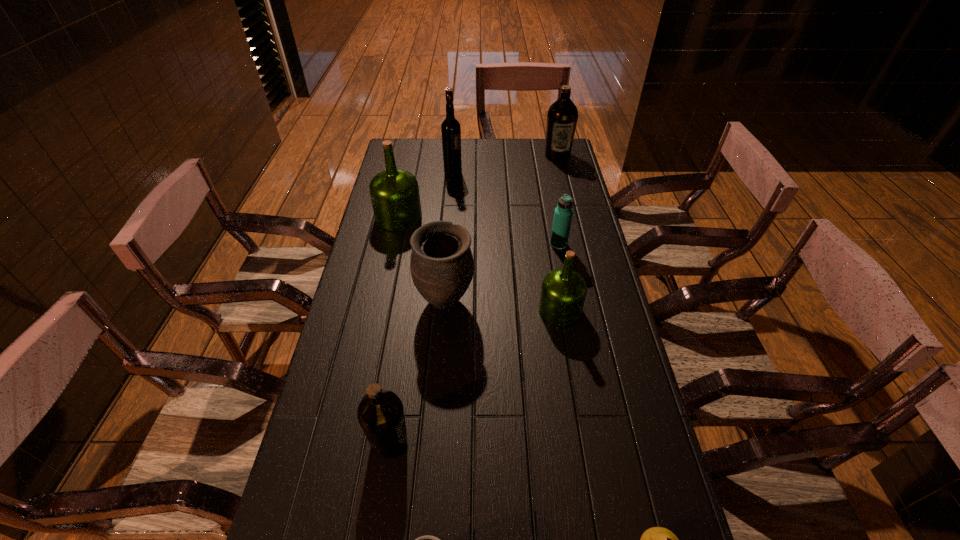
Identify the location of thermos bottle that is at the right edge. This screenshot has height=540, width=960. (563, 213).

Where is `object that is at the far right corner`? This screenshot has height=540, width=960. object that is at the far right corner is located at coordinates (562, 116).

At what (x,y) coordinates should I click in order to perform the action: click on vacant space at the far edge. Please return your answer as a coordinate pair (x, y). Looking at the image, I should click on (494, 154).

Where is `free point at the left edge`? The image size is (960, 540). free point at the left edge is located at coordinates click(340, 381).

Locate an element on the screen. The height and width of the screenshot is (540, 960). free space at the right edge of the desktop is located at coordinates (601, 504).

This screenshot has height=540, width=960. In the image, there is a desktop. What are the coordinates of `vacant space at the far left corner` in the screenshot? It's located at [407, 166].

Image resolution: width=960 pixels, height=540 pixels. In order to click on vacant region between the farther brown olive oil and the urn in this screenshot , I will do `click(501, 228)`.

Find the location of a particular element. This screenshot has height=540, width=960. unoccupied position between the left brown olive oil and the sixth nearest object is located at coordinates (474, 343).

The width and height of the screenshot is (960, 540). What are the coordinates of `empty space between the left brown olive oil and the third farthest olive oil` in the screenshot? It's located at (474, 375).

Locate an element on the screen. The height and width of the screenshot is (540, 960). free point between the seventh farthest object and the bigger brown olive oil is located at coordinates (473, 298).